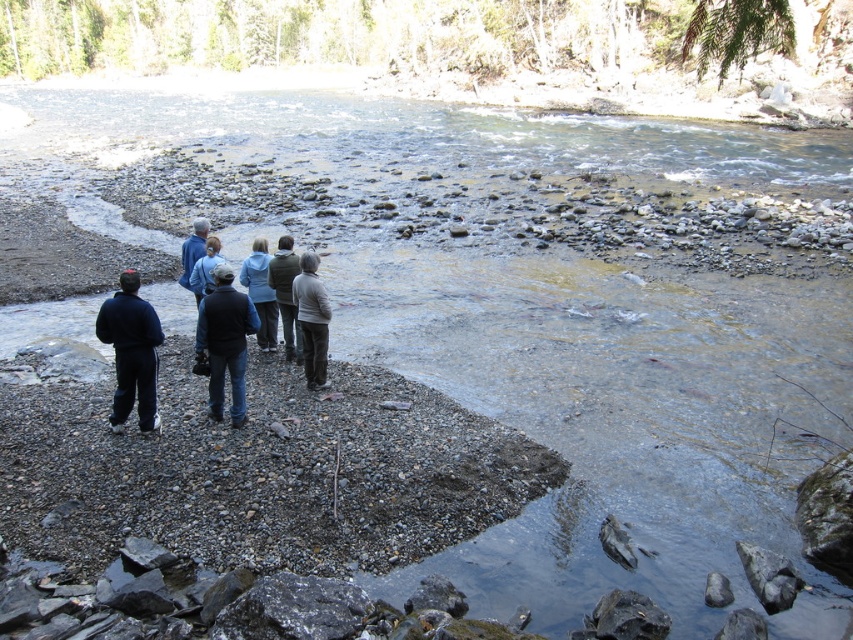
Can you confirm if dark blue fleece jacket at lower left is bigger than light gray sweater at center?

Indeed, dark blue fleece jacket at lower left has a larger size compared to light gray sweater at center.

Which is below, dark blue fleece jacket at lower left or light gray sweater at center?

dark blue fleece jacket at lower left is lower down.

Is point (151, 406) positioned in front of point (328, 312)?

Yes, it is in front of point (328, 312).

Locate an element on the screen. dark blue fleece jacket at lower left is located at coordinates (131, 352).

How distant is dark blue jacket at center from blue fleece jacket at center?

The distance of dark blue jacket at center from blue fleece jacket at center is 7.43 feet.

Find the location of a particular element. The image size is (853, 640). dark blue jacket at center is located at coordinates (225, 342).

Does point (244, 410) come in front of point (254, 259)?

That is True.

You are a GUI agent. You are given a task and a screenshot of the screen. Output one action in this format:
    pyautogui.click(x=<x>, y=<y>)
    Task: Click on the dark blue jacket at center
    This screenshot has width=853, height=640.
    Given the screenshot: What is the action you would take?
    pyautogui.click(x=225, y=342)

Is point (155, 330) more distant than point (250, 272)?

No, it is in front of (250, 272).

Is dark blue fleece jacket at lower left bigger than blue fleece jacket at center?

Correct, dark blue fleece jacket at lower left is larger in size than blue fleece jacket at center.

The image size is (853, 640). Identify the location of dark blue fleece jacket at lower left. (131, 352).

Find the location of a particular element. dark blue fleece jacket at lower left is located at coordinates (131, 352).